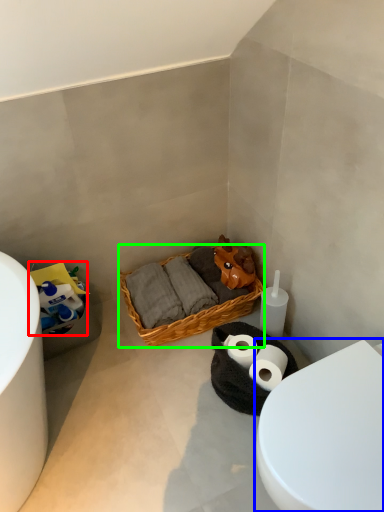
Question: Which object is positioned closest to toilet paper (highlighted by a red box)? Select from toilet (highlighted by a blue box) and picnic basket (highlighted by a green box).

Choices:
 (A) toilet
 (B) picnic basket

Answer: (B)